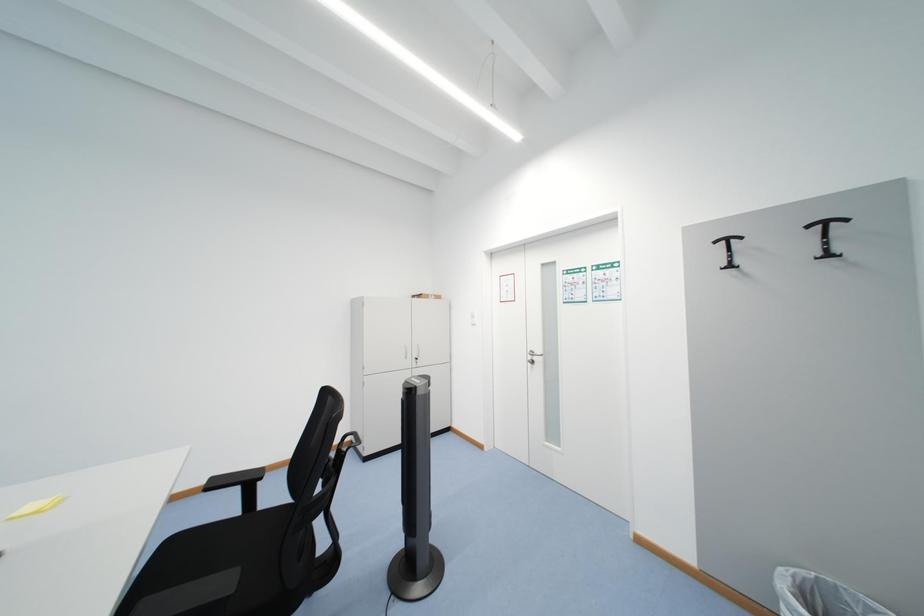
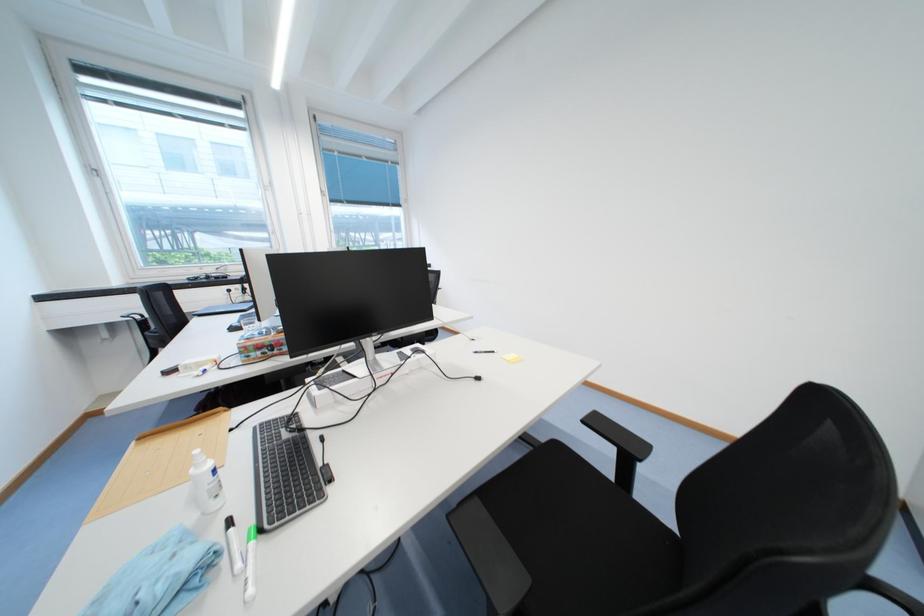
Question: The images are taken continuously from a first-person perspective. In which direction is your viewpoint rotating?

Choices:
 (A) Left
 (B) Right
 (C) Up
 (D) Down

Answer: (A)